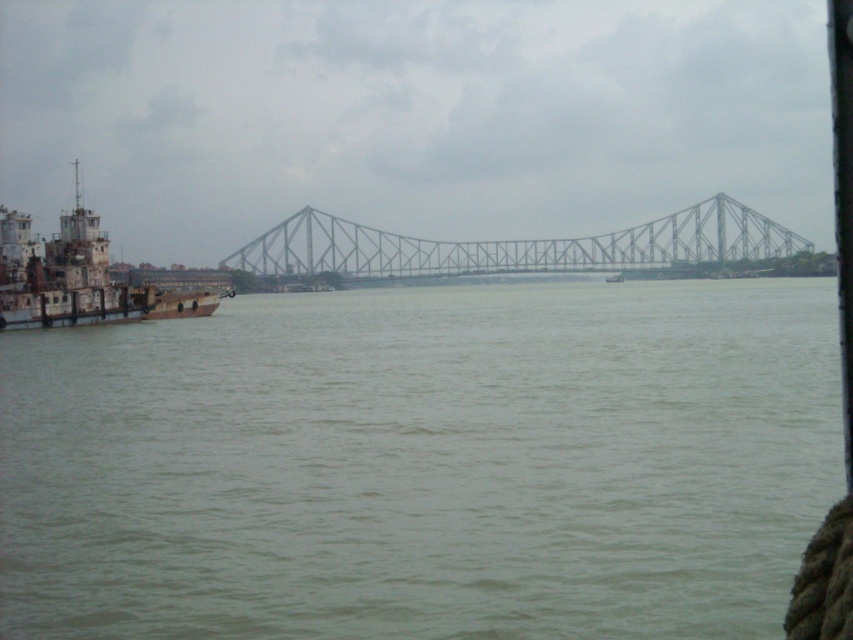
Question: Observing the image, what is the correct spatial positioning of greenish water at center in reference to metallic gray boat at center?

Choices:
 (A) below
 (B) above

Answer: (A)

Question: Among these points, which one is nearest to the camera?

Choices:
 (A) (572, 452)
 (B) (680, 248)

Answer: (A)

Question: Is metallic gray bridge at center wider than rusty metal barge at left?

Choices:
 (A) yes
 (B) no

Answer: (A)

Question: Estimate the real-world distances between objects in this image. Which object is farther from the greenish water at center?

Choices:
 (A) rusty metal barge at left
 (B) metallic gray boat at center
 (C) metallic gray bridge at center

Answer: (B)

Question: Which of the following is the farthest from the observer?

Choices:
 (A) (15, 241)
 (B) (289, 221)

Answer: (B)

Question: Is metallic gray bridge at center thinner than rusty metal barge at left?

Choices:
 (A) no
 (B) yes

Answer: (A)